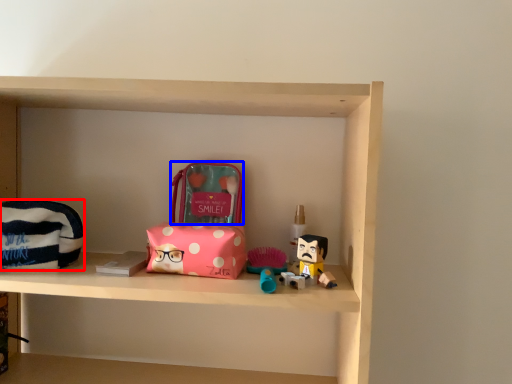
Question: Which object is further to the camera taking this photo, pouch (highlighted by a red box) or pouch (highlighted by a blue box)?

Choices:
 (A) pouch
 (B) pouch

Answer: (B)